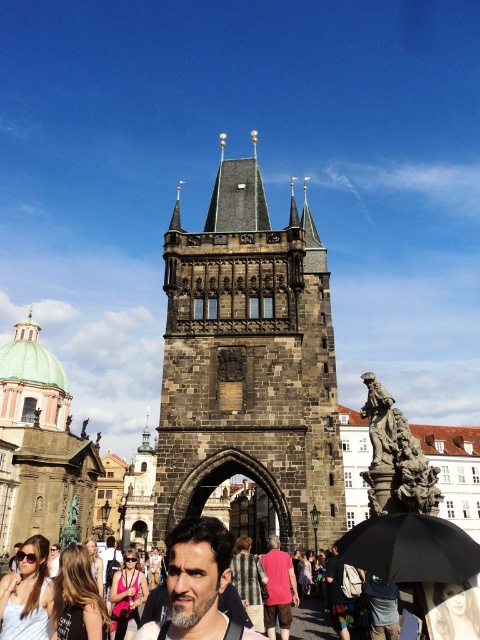
Does white cotton shirt at lower left have a lesser width compared to pink fabric dress at lower center?

Indeed, white cotton shirt at lower left has a lesser width compared to pink fabric dress at lower center.

Can you confirm if white cotton shirt at lower left is positioned below pink fabric dress at lower center?

No, white cotton shirt at lower left is not below pink fabric dress at lower center.

The height and width of the screenshot is (640, 480). What are the coordinates of `white cotton shirt at lower left` in the screenshot? It's located at (27, 595).

Who is taller, dark stone tower at center or pink fabric dress at lower center?

dark stone tower at center is taller.

Which is behind, point (252, 460) or point (124, 611)?

The point (252, 460) is more distant.

Describe the element at coordinates (249, 362) in the screenshot. The image size is (480, 640). I see `dark stone tower at center` at that location.

The image size is (480, 640). In order to click on dark stone tower at center in this screenshot , I will do `click(249, 362)`.

Does point (132, 582) lie behind point (386, 612)?

Yes, point (132, 582) is farther from viewer.

Is point (137, 589) in front of point (372, 588)?

No, (137, 589) is further to viewer.

Find the location of a particular element. pink fabric dress at lower center is located at coordinates (128, 595).